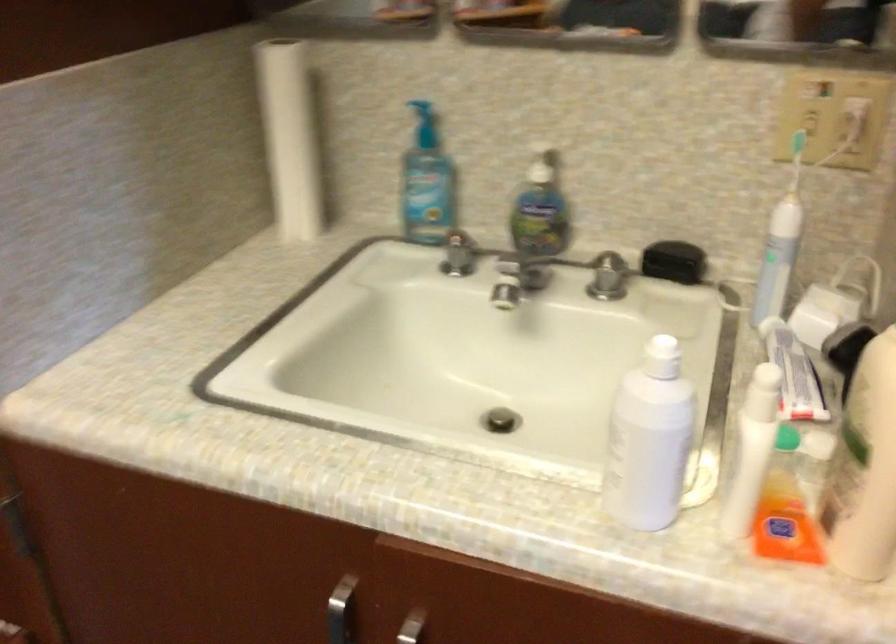
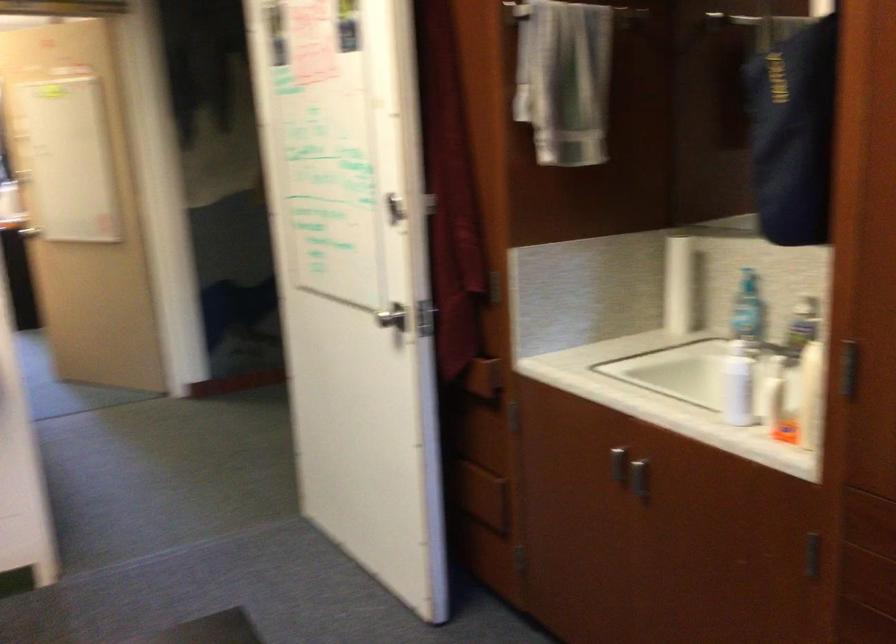
Find the pixel in the second image that matches (x=433, y=134) in the first image.

(747, 279)